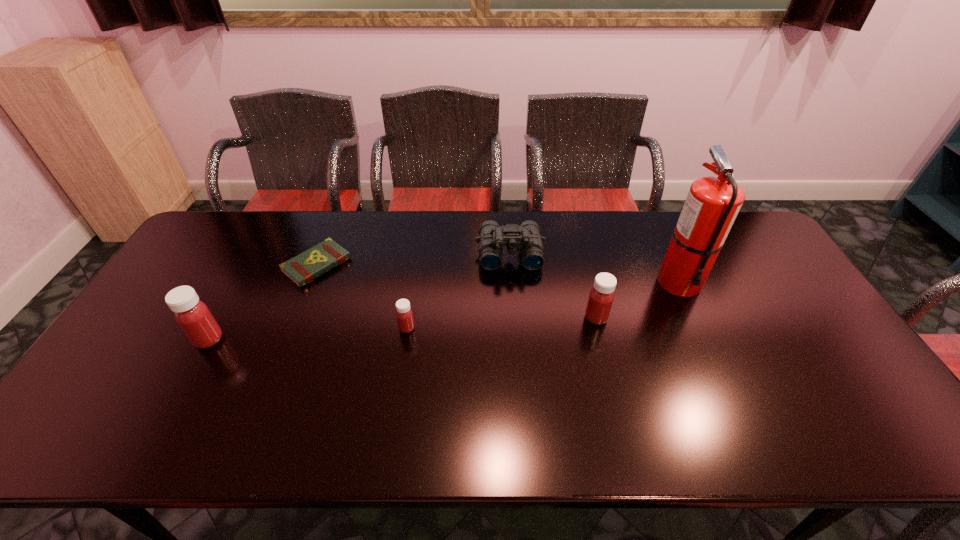
Find the location of `free space between the leftmost object and the fifth object from right to left`. free space between the leftmost object and the fifth object from right to left is located at coordinates (263, 302).

Locate an element on the screen. free space between the fourth tallest object and the leftmost object is located at coordinates (359, 296).

The height and width of the screenshot is (540, 960). I want to click on free space that is in between the tallest object and the leftmost medicine, so click(444, 310).

The height and width of the screenshot is (540, 960). Find the location of `empty space that is in between the rightmost medicine and the book`. empty space that is in between the rightmost medicine and the book is located at coordinates pos(457,291).

Where is `object that is the fourth nearest to the leftmost object`? object that is the fourth nearest to the leftmost object is located at coordinates (601, 296).

What are the coordinates of `the fifth closest object to the leftmost medicine` in the screenshot? It's located at (713, 203).

The height and width of the screenshot is (540, 960). I want to click on medicine that is the second closest one to the second shortest object, so click(x=601, y=296).

Find the location of a particular element. medicine that is the closest to the leftmost medicine is located at coordinates (404, 314).

I want to click on free region that satisfies the following two spatial constraints: 1. through the lenses of the fourth object from left to right; 2. on the left side of the second object from right to left, so click(x=515, y=318).